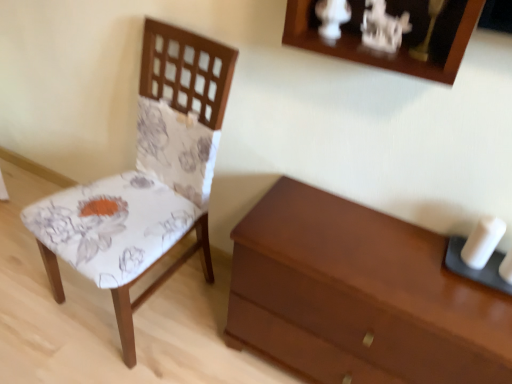
Identify the location of free spot above matte brown chest of drawers at lower right (from a real-world perspective). The image size is (512, 384). (386, 249).